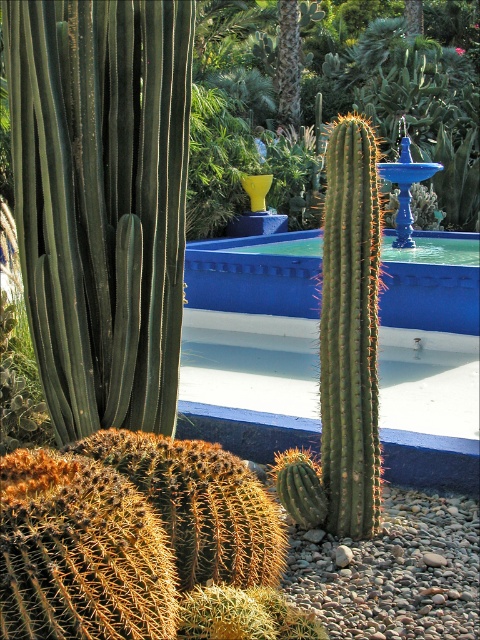
Can you confirm if green spiny cactus at center is positioned to the left of blue smooth pool at center?

In fact, green spiny cactus at center is to the right of blue smooth pool at center.

Between point (351, 1) and point (437, 296), which one is positioned behind?

The point (351, 1) is behind.

Describe the element at coordinates (405, 86) in the screenshot. I see `green spiny cactus at center` at that location.

Locate an element on the screen. The width and height of the screenshot is (480, 640). green spiny cactus at center is located at coordinates (405, 86).